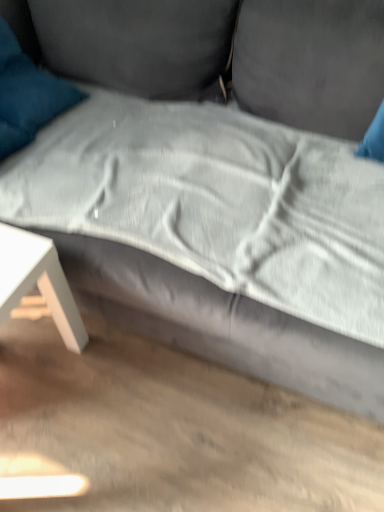
The width and height of the screenshot is (384, 512). Describe the element at coordinates (27, 95) in the screenshot. I see `teal soft cushion at upper left` at that location.

You are a GUI agent. You are given a task and a screenshot of the screen. Output one action in this format:
    pyautogui.click(x=<x>, y=<y>)
    Task: Click on the teal soft cushion at upper left
    The height and width of the screenshot is (512, 384).
    Given the screenshot: What is the action you would take?
    pyautogui.click(x=27, y=95)

Where is `white matte table at lower left`? Image resolution: width=384 pixels, height=512 pixels. white matte table at lower left is located at coordinates tap(38, 281).

Image resolution: width=384 pixels, height=512 pixels. Describe the element at coordinates (38, 281) in the screenshot. I see `white matte table at lower left` at that location.

The width and height of the screenshot is (384, 512). I want to click on teal soft cushion at upper left, so click(x=27, y=95).

Considering the positions of objects teal soft cushion at upper left and white matte table at lower left in the image provided, who is more to the left, teal soft cushion at upper left or white matte table at lower left?

Positioned to the left is white matte table at lower left.

Which object is closer to the camera taking this photo, teal soft cushion at upper left or white matte table at lower left?

white matte table at lower left is closer to the camera.

Is point (30, 60) in front of point (70, 331)?

No, (30, 60) is further to viewer.

From the image's perspective, is teal soft cushion at upper left located above white matte table at lower left?

Yes, from the image's perspective, teal soft cushion at upper left is on top of white matte table at lower left.

From a real-world perspective, is teal soft cushion at upper left beneath white matte table at lower left?

Actually, teal soft cushion at upper left is physically above white matte table at lower left in the real world.

Can you confirm if teal soft cushion at upper left is wider than white matte table at lower left?

Correct, the width of teal soft cushion at upper left exceeds that of white matte table at lower left.

In the scene shown: Considering the sizes of objects teal soft cushion at upper left and white matte table at lower left in the image provided, who is taller, teal soft cushion at upper left or white matte table at lower left?

white matte table at lower left.

Considering the sizes of objects teal soft cushion at upper left and white matte table at lower left in the image provided, who is smaller, teal soft cushion at upper left or white matte table at lower left?

With smaller size is teal soft cushion at upper left.

From the picture: Is teal soft cushion at upper left outside of white matte table at lower left?

teal soft cushion at upper left lies outside white matte table at lower left's area.

Are teal soft cushion at upper left and white matte table at lower left beside each other?

No.

Could you tell me if teal soft cushion at upper left is turned towards white matte table at lower left?

No, teal soft cushion at upper left is not turned towards white matte table at lower left.

How different are the orientations of teal soft cushion at upper left and white matte table at lower left in degrees?

7.33 degrees separate the facing orientations of teal soft cushion at upper left and white matte table at lower left.

Identify the location of table on the left of teal soft cushion at upper left. The image size is (384, 512). (38, 281).

Considering the relative positions of white matte table at lower left and teal soft cushion at upper left in the image provided, is white matte table at lower left to the left or to the right of teal soft cushion at upper left?

white matte table at lower left is positioned on teal soft cushion at upper left's left side.

Is white matte table at lower left in front of teal soft cushion at upper left?

That is True.

Is point (40, 289) behind point (1, 117)?

No, it is in front of (1, 117).

From the image's perspective, who appears lower, white matte table at lower left or teal soft cushion at upper left?

white matte table at lower left.

Looking at this image, from a real-world perspective, which object stands above the other?

teal soft cushion at upper left, from a real-world perspective.

Between white matte table at lower left and teal soft cushion at upper left, which one has smaller width?

white matte table at lower left.

From the picture: Considering the relative sizes of white matte table at lower left and teal soft cushion at upper left in the image provided, is white matte table at lower left taller than teal soft cushion at upper left?

Yes.

Can you confirm if white matte table at lower left is smaller than teal soft cushion at upper left?

Incorrect, white matte table at lower left is not smaller in size than teal soft cushion at upper left.

Is white matte table at lower left surrounding teal soft cushion at upper left?

No, teal soft cushion at upper left is not inside white matte table at lower left.

Is white matte table at lower left far away from teal soft cushion at upper left?

No, white matte table at lower left is in close proximity to teal soft cushion at upper left.

Is white matte table at lower left turned away from teal soft cushion at upper left?

No, teal soft cushion at upper left is not at the back of white matte table at lower left.

You are a GUI agent. You are given a task and a screenshot of the screen. Output one action in this format:
    pyautogui.click(x=<x>, y=<y>)
    Task: Click on the pillow that appears above the white matte table at lower left (from a real-world perspective)
    The width and height of the screenshot is (384, 512).
    Given the screenshot: What is the action you would take?
    pyautogui.click(x=27, y=95)

The image size is (384, 512). Find the location of `table on the left of teal soft cushion at upper left`. table on the left of teal soft cushion at upper left is located at coordinates (38, 281).

This screenshot has height=512, width=384. I want to click on table below the teal soft cushion at upper left (from the image's perspective), so click(x=38, y=281).